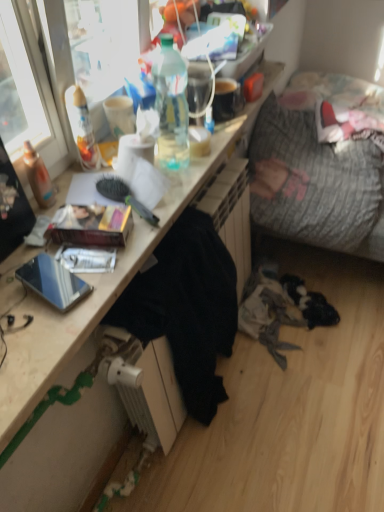
What do you see at coordinates (315, 172) in the screenshot?
I see `textured gray fabric couch at right` at bounding box center [315, 172].

The height and width of the screenshot is (512, 384). Describe the element at coordinates (53, 282) in the screenshot. I see `shiny metallic phone at lower left` at that location.

Describe the element at coordinates (171, 105) in the screenshot. I see `translucent plastic bottle at upper center, marked as the second bottle in a left-to-right arrangement` at that location.

In order to face translucent plastic bottle at upper left, placed as the second bottle when sorted from right to left, should I rotate leftwards or rightwards?

To face it directly, rotate left by 13.577 degrees.

In order to face matte cardboard book at center, should I rotate leftwards or rightwards?

Rotate left and turn 13.151 degrees.

This screenshot has height=512, width=384. What are the coordinates of `wooden desk at center` in the screenshot? It's located at (112, 277).

Identify the location of textured gray fabric couch at right. Image resolution: width=384 pixels, height=512 pixels. (315, 172).

Is translucent plastic bottle at upper center, marked as the second bottle in a left-to-right arrangement, to the right of matte cardboard book at center from the viewer's perspective?

Yes, translucent plastic bottle at upper center, marked as the second bottle in a left-to-right arrangement, is to the right of matte cardboard book at center.

Considering the relative sizes of translucent plastic bottle at upper center, acting as the 1th bottle starting from the right, and matte cardboard book at center in the image provided, is translucent plastic bottle at upper center, acting as the 1th bottle starting from the right, bigger than matte cardboard book at center?

Yes.

Is translucent plastic bottle at upper center, marked as the second bottle in a left-to-right arrangement, looking in the opposite direction of matte cardboard book at center?

No, translucent plastic bottle at upper center, marked as the second bottle in a left-to-right arrangement,'s orientation is not away from matte cardboard book at center.

From the picture: From the image's perspective, is black fabric at lower center over translucent plastic bottle at upper center, acting as the 1th bottle starting from the right?

Incorrect, from the image's perspective, black fabric at lower center is lower than translucent plastic bottle at upper center, acting as the 1th bottle starting from the right.

Considering the positions of objects black fabric at lower center and translucent plastic bottle at upper center, acting as the 1th bottle starting from the right, in the image provided, who is in front, black fabric at lower center or translucent plastic bottle at upper center, acting as the 1th bottle starting from the right,?

black fabric at lower center is in front.

Could you tell me if black fabric at lower center is facing translucent plastic bottle at upper center, marked as the second bottle in a left-to-right arrangement?

No, black fabric at lower center is not oriented towards translucent plastic bottle at upper center, marked as the second bottle in a left-to-right arrangement.

Visually, is black fabric at lower center positioned to the left or to the right of translucent plastic bottle at upper center, acting as the 1th bottle starting from the right?

Based on their positions, black fabric at lower center is located to the right of translucent plastic bottle at upper center, acting as the 1th bottle starting from the right.

Considering the points (35, 312) and (78, 216), which point is in front, point (35, 312) or point (78, 216)?

The point (35, 312) is closer to the camera.

Measure the distance between wooden desk at center and matte cardboard book at center.

wooden desk at center and matte cardboard book at center are 11.57 inches apart from each other.

Which object is thinner, wooden desk at center or matte cardboard book at center?

matte cardboard book at center.

Could you tell me if wooden desk at center is facing matte cardboard book at center?

No, wooden desk at center does not turn towards matte cardboard book at center.

In the image, is translucent plastic bottle at upper center, marked as the second bottle in a left-to-right arrangement, on the left side or the right side of translucent plastic bottle at upper left, placed as the second bottle when sorted from right to left?

translucent plastic bottle at upper center, marked as the second bottle in a left-to-right arrangement, is to the right of translucent plastic bottle at upper left, placed as the second bottle when sorted from right to left.

Considering the positions of points (181, 88) and (77, 141), is point (181, 88) farther from camera compared to point (77, 141)?

Yes, it is behind point (77, 141).

Is translucent plastic bottle at upper center, marked as the second bottle in a left-to-right arrangement, not close to translucent plastic bottle at upper left, the first bottle when ordered from left to right?

No.

How distant is translucent plastic bottle at upper center, acting as the 1th bottle starting from the right, from translucent plastic bottle at upper left, the first bottle when ordered from left to right?

translucent plastic bottle at upper center, acting as the 1th bottle starting from the right, is 24.97 centimeters away from translucent plastic bottle at upper left, the first bottle when ordered from left to right.

Is textured gray fabric couch at right at the back of black fabric at lower center?

No, textured gray fabric couch at right is not at the back of black fabric at lower center.

Is black fabric at lower center bigger than textured gray fabric couch at right?

Actually, black fabric at lower center might be smaller than textured gray fabric couch at right.

Can you confirm if black fabric at lower center is thinner than textured gray fabric couch at right?

Yes, black fabric at lower center is thinner than textured gray fabric couch at right.

Does black fabric at lower center have a greater height compared to textured gray fabric couch at right?

Indeed, black fabric at lower center has a greater height compared to textured gray fabric couch at right.

Considering the sizes of objects translucent plastic bottle at upper center, marked as the second bottle in a left-to-right arrangement, and wooden desk at center in the image provided, who is thinner, translucent plastic bottle at upper center, marked as the second bottle in a left-to-right arrangement, or wooden desk at center?

Thinner between the two is translucent plastic bottle at upper center, marked as the second bottle in a left-to-right arrangement.

Is translucent plastic bottle at upper center, marked as the second bottle in a left-to-right arrangement, inside the boundaries of wooden desk at center, or outside?

translucent plastic bottle at upper center, marked as the second bottle in a left-to-right arrangement, cannot be found inside wooden desk at center.

Does translucent plastic bottle at upper center, marked as the second bottle in a left-to-right arrangement, have a larger size compared to wooden desk at center?

No, translucent plastic bottle at upper center, marked as the second bottle in a left-to-right arrangement, is not bigger than wooden desk at center.

How different are the orientations of translucent plastic bottle at upper center, marked as the second bottle in a left-to-right arrangement, and wooden desk at center in degrees?

The angle between the facing direction of translucent plastic bottle at upper center, marked as the second bottle in a left-to-right arrangement, and the facing direction of wooden desk at center is 2.13 degrees.

From a real-world perspective, which is physically above, shiny metallic phone at lower left or wooden desk at center?

In real-world perspective, shiny metallic phone at lower left is above.

Considering the points (35, 263) and (88, 454), which point is in front, point (35, 263) or point (88, 454)?

The point (35, 263) is closer to the camera.

Is shiny metallic phone at lower left behind wooden desk at center?

Yes, it is behind wooden desk at center.

Is shiny metallic phone at lower left facing towards wooden desk at center?

No, shiny metallic phone at lower left is not oriented towards wooden desk at center.

Find the location of a particular element. bottle to the right of matte cardboard book at center is located at coordinates (171, 105).

This screenshot has height=512, width=384. Find the location of `the 2nd bottle above the black fabric at lower center (from the image's perspective)`. the 2nd bottle above the black fabric at lower center (from the image's perspective) is located at coordinates (171, 105).

Looking at the image, which one is located closer to matte cardboard book at center, shiny metallic phone at lower left or translucent plastic bottle at upper center, acting as the 1th bottle starting from the right?

Among the two, shiny metallic phone at lower left is located nearer to matte cardboard book at center.

When comparing their distances from shiny metallic phone at lower left, does matte cardboard book at center or textured gray fabric couch at right seem further?

The object further to shiny metallic phone at lower left is textured gray fabric couch at right.

When comparing their distances from matte cardboard book at center, does translucent plastic bottle at upper left, the first bottle when ordered from left to right, or shiny metallic phone at lower left seem further?

Among the two, translucent plastic bottle at upper left, the first bottle when ordered from left to right, is located further to matte cardboard book at center.

From the image, which object appears to be nearer to matte cardboard book at center, translucent plastic bottle at upper left, the first bottle when ordered from left to right, or black fabric at lower center?

translucent plastic bottle at upper left, the first bottle when ordered from left to right, is closer to matte cardboard book at center.

Looking at the image, which one is located closer to translucent plastic bottle at upper center, marked as the second bottle in a left-to-right arrangement, translucent plastic bottle at upper left, the first bottle when ordered from left to right, or black fabric at lower center?

translucent plastic bottle at upper left, the first bottle when ordered from left to right, is positioned closer to the anchor translucent plastic bottle at upper center, marked as the second bottle in a left-to-right arrangement.

Based on their spatial positions, is textured gray fabric couch at right or translucent plastic bottle at upper left, placed as the second bottle when sorted from right to left, closer to wooden desk at center?

Based on the image, translucent plastic bottle at upper left, placed as the second bottle when sorted from right to left, appears to be nearer to wooden desk at center.

Considering their positions, is translucent plastic bottle at upper center, acting as the 1th bottle starting from the right, positioned closer to shiny metallic phone at lower left than black fabric at lower center?

black fabric at lower center lies closer to shiny metallic phone at lower left than the other object.

Based on their spatial positions, is matte cardboard book at center or translucent plastic bottle at upper center, marked as the second bottle in a left-to-right arrangement, closer to textured gray fabric couch at right?

translucent plastic bottle at upper center, marked as the second bottle in a left-to-right arrangement, lies closer to textured gray fabric couch at right than the other object.

This screenshot has width=384, height=512. I want to click on bottle between translucent plastic bottle at upper center, acting as the 1th bottle starting from the right, and matte cardboard book at center from top to bottom, so click(82, 128).

At what (x,y) coordinates should I click in order to perform the action: click on desk between translucent plastic bottle at upper left, placed as the second bottle when sorted from right to left, and black fabric at lower center from top to bottom. Please return your answer as a coordinate pair (x, y). Looking at the image, I should click on (112, 277).

The height and width of the screenshot is (512, 384). In order to click on book between wooden desk at center and translucent plastic bottle at upper center, acting as the 1th bottle starting from the right, in the front-back direction in this screenshot , I will do `click(91, 225)`.

Image resolution: width=384 pixels, height=512 pixels. In order to click on desk between translucent plastic bottle at upper center, marked as the second bottle in a left-to-right arrangement, and shiny metallic phone at lower left from top to bottom in this screenshot , I will do `click(112, 277)`.